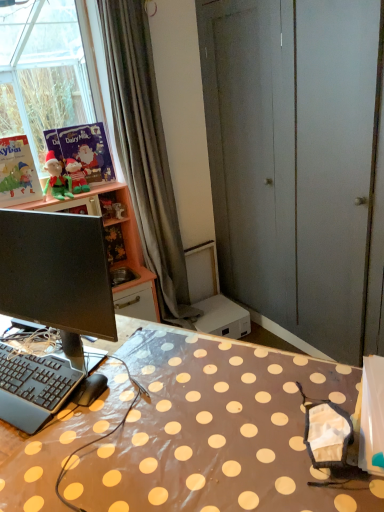
Question: In terms of height, does matte pink cabinet at upper left look taller or shorter compared to gray fabric curtain at upper left?

Choices:
 (A) tall
 (B) short

Answer: (B)

Question: From the image's perspective, is matte pink cabinet at upper left positioned above or below gray fabric curtain at upper left?

Choices:
 (A) above
 (B) below

Answer: (B)

Question: Which object is positioned closest to the black plastic keyboard at lower left?

Choices:
 (A) matte pink cabinet at upper left
 (B) matte paper book at upper left, which ranks as the 1th book in right-to-left order
 (C) black rubberized computer mouse at lower left
 (D) black matte computer monitor at left
 (E) brown polka dot table at center

Answer: (C)

Question: Which object is the farthest from the brown polka dot table at center?

Choices:
 (A) black rubberized computer mouse at lower left
 (B) matte green plush at upper left, which appears as the 1th person when viewed from the right
 (C) green plush elf at left, which appears as the first person when viewed from the left
 (D) matte paper book at upper left, marked as the 1th book in a left-to-right arrangement
 (E) black matte computer monitor at left

Answer: (B)